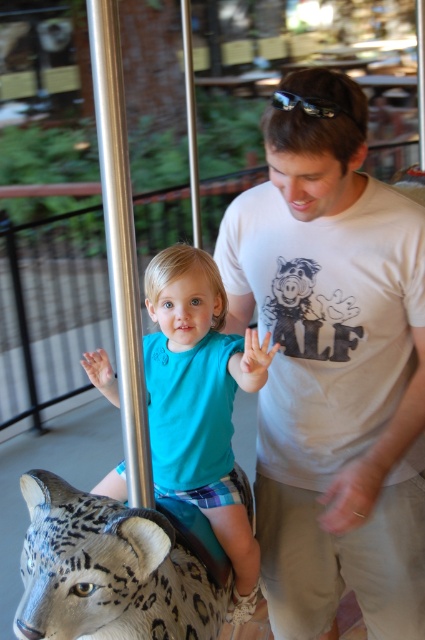
Question: Is leopard statue at center to the left of teal matte shirt at center from the viewer's perspective?

Choices:
 (A) yes
 (B) no

Answer: (A)

Question: Based on their relative distances, which object is farther from the teal matte shirt at center?

Choices:
 (A) white cotton t-shirt at center
 (B) leopard statue at center

Answer: (B)

Question: Does white cotton t-shirt at center appear under leopard statue at center?

Choices:
 (A) no
 (B) yes

Answer: (A)

Question: Which of the following is the closest to the observer?

Choices:
 (A) white cotton t-shirt at center
 (B) leopard statue at center

Answer: (B)

Question: Does white cotton t-shirt at center have a larger size compared to teal matte shirt at center?

Choices:
 (A) yes
 (B) no

Answer: (A)

Question: Estimate the real-world distances between objects in this image. Which object is farther from the teal matte shirt at center?

Choices:
 (A) white cotton t-shirt at center
 (B) leopard statue at center

Answer: (B)